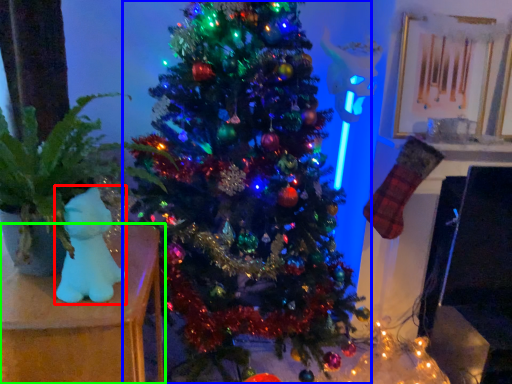
Question: Considering the real-world distances, which object is closest to toy (highlighted by a red box)? christmas tree (highlighted by a blue box) or furniture (highlighted by a green box).

Choices:
 (A) christmas tree
 (B) furniture

Answer: (B)